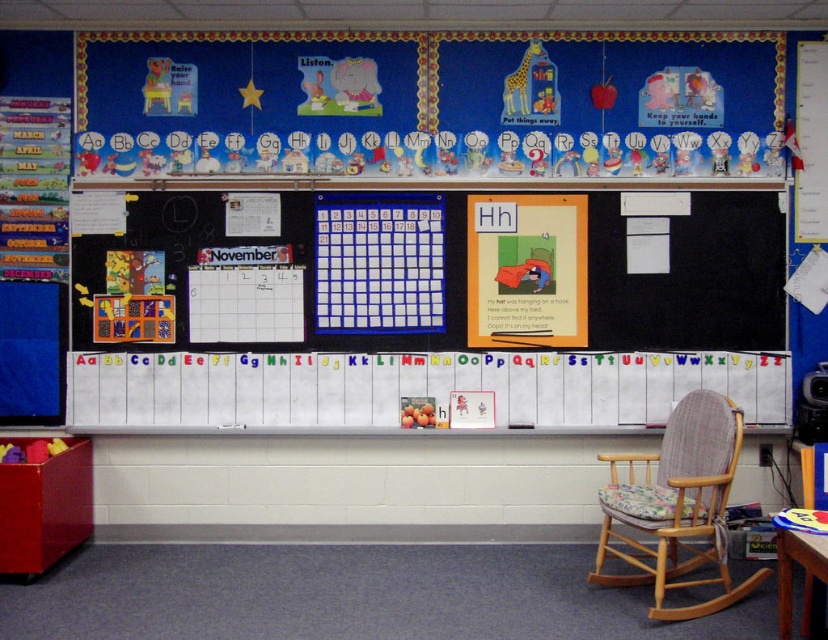
You are a teacher who wants to hang a new poster between the matte black calendar at center and the wooden upholstered rocking chair at lower right. Which object should you place the poster closer to if you want the poster to be smaller in size?

The matte black calendar at center has a smaller size compared to wooden upholstered rocking chair at lower right, so place the poster closer to the matte black calendar at center to make it smaller.

You are a teacher who wants to hang a new poster on the classroom wall. The poster is 1.2 meters wide. There is a matte black calendar at center and a wooden table at lower right. Which object can the poster fit next to without overlapping?

The matte black calendar at center has a larger width than the wooden table at lower right. Since the poster is 1.2 meters wide, it can fit next to the matte black calendar at center as it provides more space compared to the wooden table at lower right.